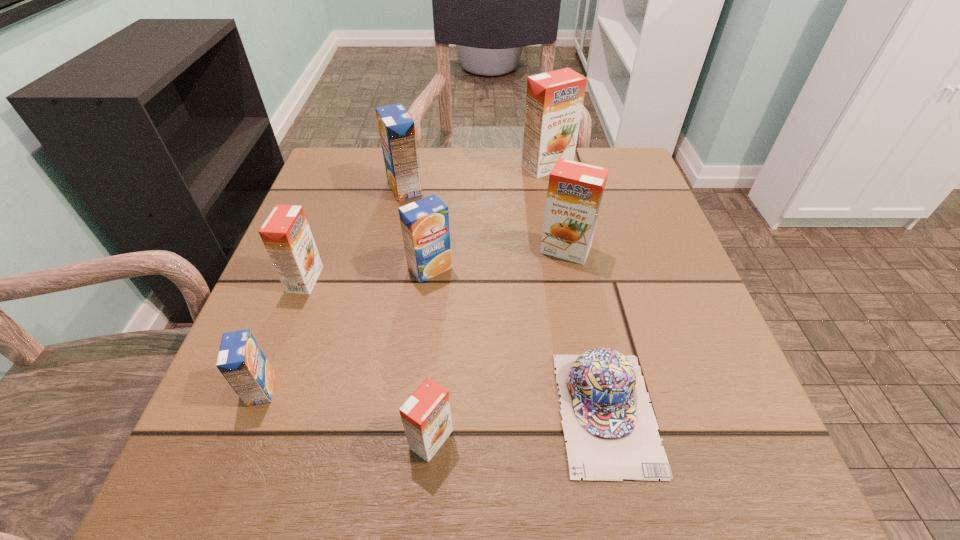
You are a GUI agent. You are given a task and a screenshot of the screen. Output one action in this format:
    pyautogui.click(x=<x>, y=<y>)
    Task: Click on the vacant space that satisfies the following two spatial constraints: 1. on the back side of the third farthest orange orange juice; 2. on the left side of the second smallest blue orange_juice
    This screenshot has width=960, height=540.
    Given the screenshot: What is the action you would take?
    pyautogui.click(x=309, y=268)

I want to click on free location that satisfies the following two spatial constraints: 1. on the front side of the third smallest orange orange juice; 2. on the right side of the tallest object, so click(x=563, y=250).